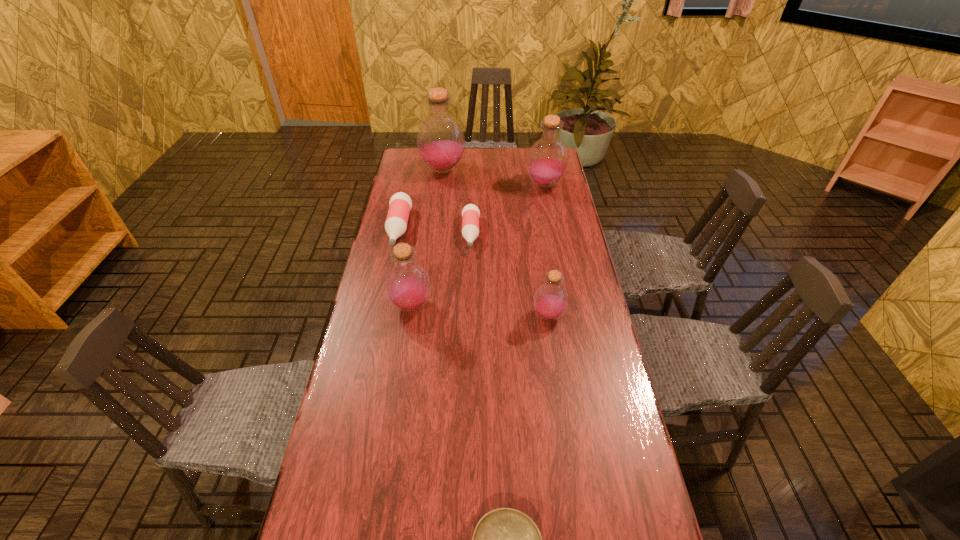
Locate an element on the screen. This screenshot has width=960, height=540. the sixth tallest object is located at coordinates (470, 214).

Where is `the smaller pink bottle`? Image resolution: width=960 pixels, height=540 pixels. the smaller pink bottle is located at coordinates (470, 214).

Identify the location of vacant area situated on the front of the tallest object. The height and width of the screenshot is (540, 960). (436, 230).

This screenshot has width=960, height=540. Find the location of `vacant point located on the front of the second tallest object`. vacant point located on the front of the second tallest object is located at coordinates (552, 220).

Where is `vacant space situated 0.360m on the back of the third biggest purple bottle`? The width and height of the screenshot is (960, 540). vacant space situated 0.360m on the back of the third biggest purple bottle is located at coordinates (423, 224).

The image size is (960, 540). I want to click on free space located 0.220m on the left of the fourth shortest object, so click(461, 316).

Image resolution: width=960 pixels, height=540 pixels. In order to click on vacant space located 0.150m with the cap open on the bigger pink bottle in this screenshot , I will do `click(387, 284)`.

Locate an element on the screen. free spot located 0.120m with the cap open on the smaller pink bottle is located at coordinates (469, 278).

I want to click on object situated at the far edge, so click(x=440, y=140).

Where is `object that is positioned at the far left corner`? This screenshot has width=960, height=540. object that is positioned at the far left corner is located at coordinates (440, 140).